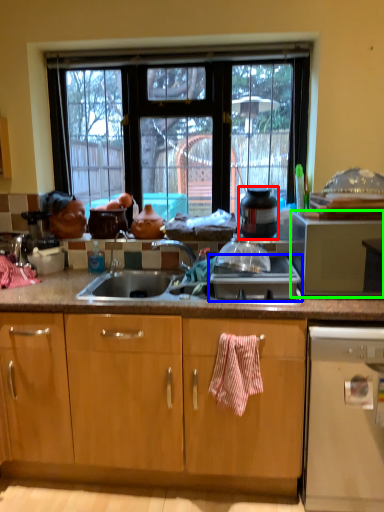
Question: Which is farther away from appliance (highlighted by a red box)? gas stove (highlighted by a blue box) or microwave oven (highlighted by a green box)?

Choices:
 (A) gas stove
 (B) microwave oven

Answer: (B)